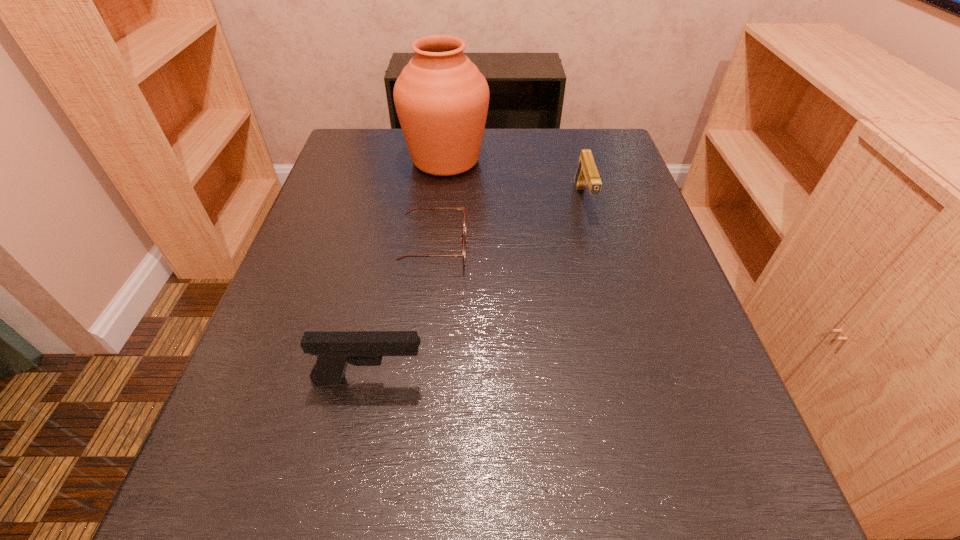
Find the location of `free region located at the front view of the second nearest object`. free region located at the front view of the second nearest object is located at coordinates (607, 248).

The height and width of the screenshot is (540, 960). Find the location of `object that is at the far edge`. object that is at the far edge is located at coordinates (441, 98).

Identify the location of object that is positioned at the left edge. The width and height of the screenshot is (960, 540). (334, 350).

You are a GUI agent. You are given a task and a screenshot of the screen. Output one action in this format:
    pyautogui.click(x=<x>, y=<y>)
    Task: Click on the object that is at the right edge
    The width and height of the screenshot is (960, 540).
    Given the screenshot: What is the action you would take?
    pyautogui.click(x=587, y=173)

At what (x,y) coordinates should I click in order to perform the action: click on free space at the far edge. Please return your answer as a coordinate pair (x, y). Image resolution: width=960 pixels, height=540 pixels. Looking at the image, I should click on (502, 139).

Locate an element on the screen. The width and height of the screenshot is (960, 540). vacant space at the left edge of the desktop is located at coordinates (326, 209).

Identify the location of vacant region at the right edge of the desktop. (617, 316).

The height and width of the screenshot is (540, 960). In order to click on vacant space at the far left corner of the desktop in this screenshot , I will do `click(346, 148)`.

Identify the location of free space at the far right corner of the desktop. The image size is (960, 540). (603, 140).

Find the location of a particular element. This screenshot has height=540, width=960. free space between the urn and the left pistol is located at coordinates (407, 269).